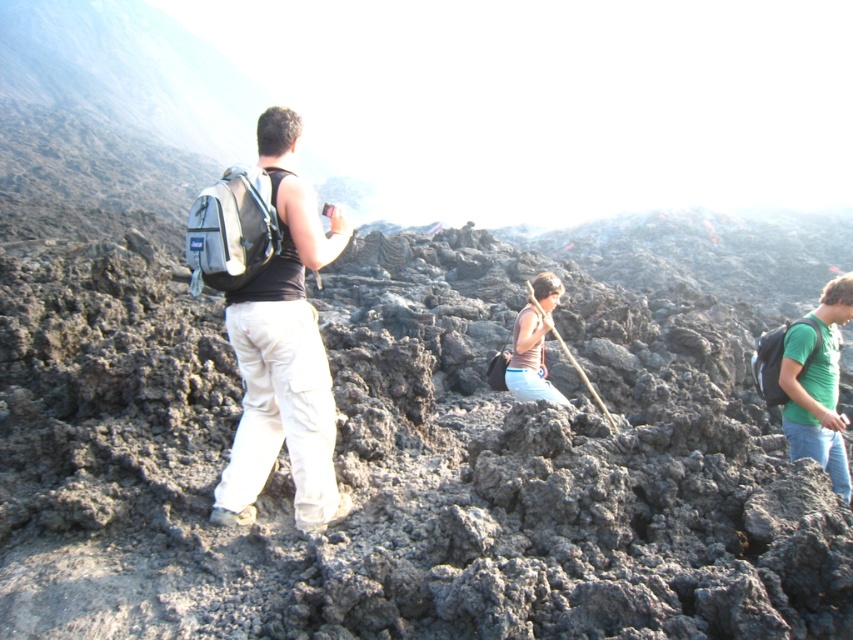
You are a photographer trying to capture the volcanic landscape. You notice the matte black backpack at center and the green matte shirt at right. Which object is closer to the left side of your frame?

The matte black backpack at center is positioned on the left side of green matte shirt at right, so it is closer to the left side of your frame.

You are navigating through the volcanic terrain and need to reach the point at coordinates point (787, 332). You are currently at point (524, 369). According to the scene description, which direction should you move to reach your destination?

Point (787, 332) is in front of point (524, 369), so you should move forward to reach the destination.

You are a photographer positioned at the center of the volcanic landscape scene. You want to take a photo of the green matte shirt at right. Where should you aim your camera to capture the subject in the frame?

You should aim your camera at the coordinates point [817,385] to capture the green matte shirt at right in the frame.